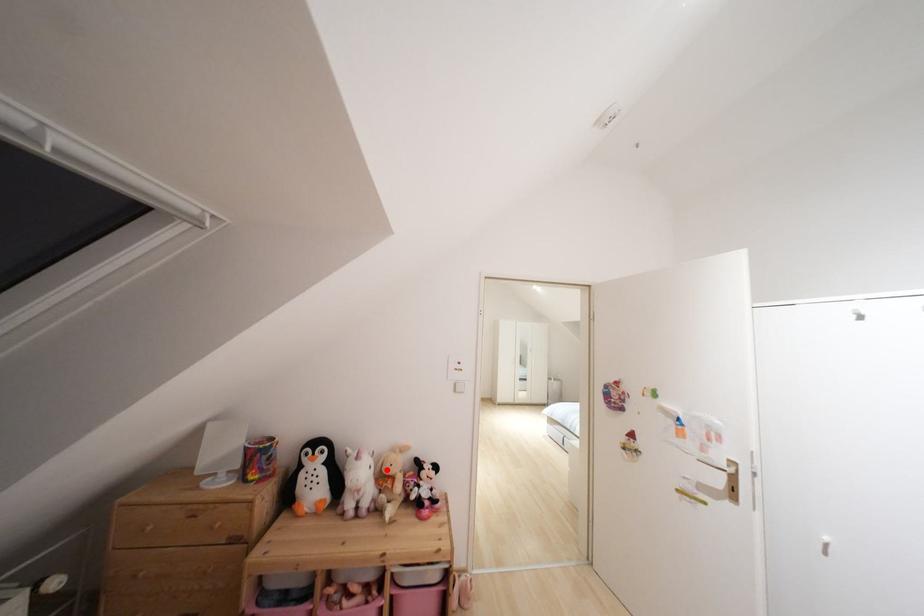
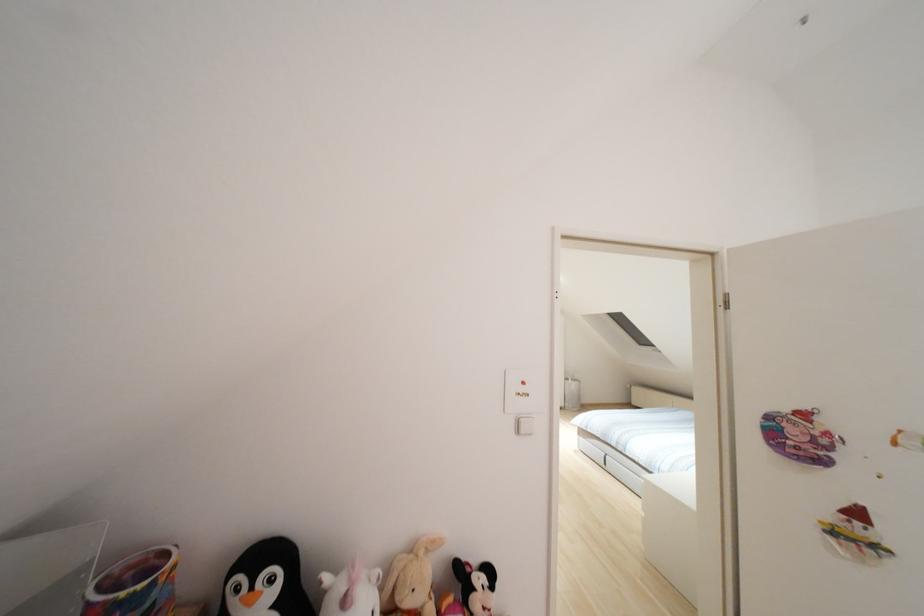
Locate, in the second image, the point that corresponds to the highlighted location in the first image.

(407, 601)